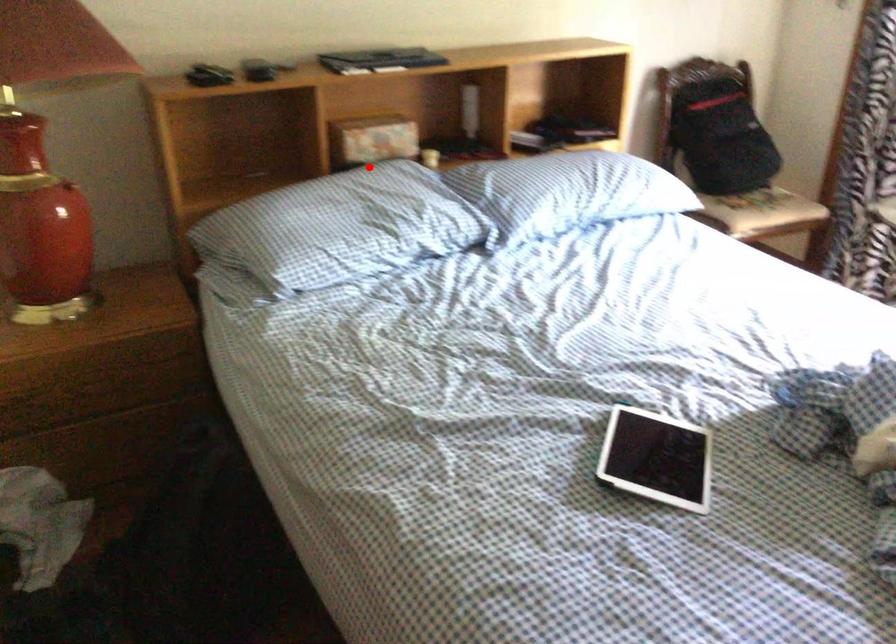
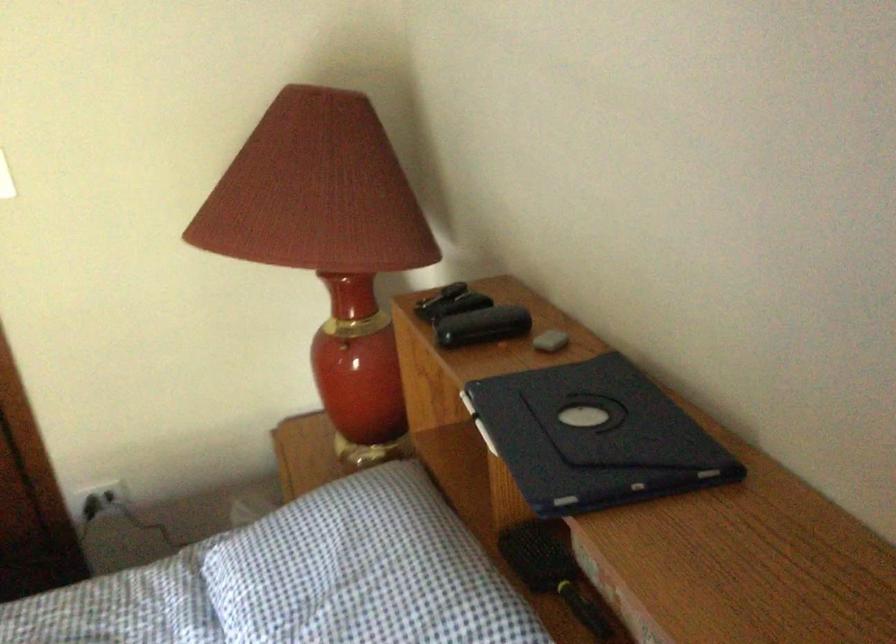
Question: I am providing you with two images of the same scene from different viewpoints. A red point is shown in image1. For the corresponding object point in image2, is it positioned nearer or farther from the camera?

Choices:
 (A) Nearer
 (B) Farther

Answer: (A)